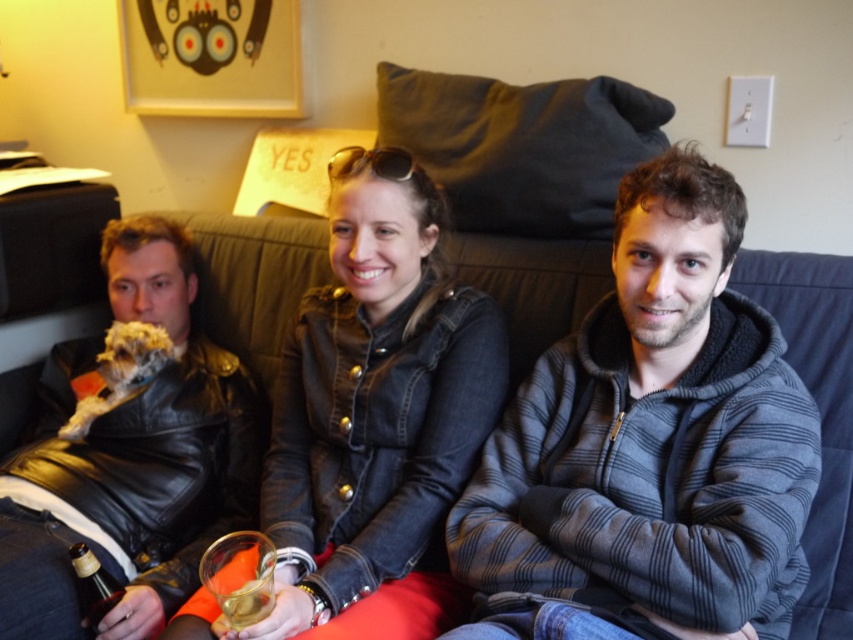
Which of these two, denim jacket at center or fluffy white dog at left, stands shorter?

fluffy white dog at left

Does denim jacket at center have a larger size compared to fluffy white dog at left?

Yes, denim jacket at center is bigger than fluffy white dog at left.

Identify the location of denim jacket at center. (372, 416).

Image resolution: width=853 pixels, height=640 pixels. What are the coordinates of `denim jacket at center` in the screenshot? It's located at (372, 416).

Between gray striped hoodie at center and denim jacket at center, which one has less height?

gray striped hoodie at center is shorter.

Is point (602, 390) farther from camera compared to point (440, 522)?

That is False.

Where is `gray striped hoodie at center`? gray striped hoodie at center is located at coordinates (648, 448).

Can you confirm if denim jacket at center is smaller than leather jacket at left?

Yes, denim jacket at center is smaller than leather jacket at left.

Between point (370, 609) and point (155, 525), which one is positioned in front?

Point (370, 609) is more forward.

Does point (310, 406) come closer to viewer compared to point (67, 497)?

Yes, point (310, 406) is in front of point (67, 497).

Locate an element on the screen. This screenshot has width=853, height=640. denim jacket at center is located at coordinates (372, 416).